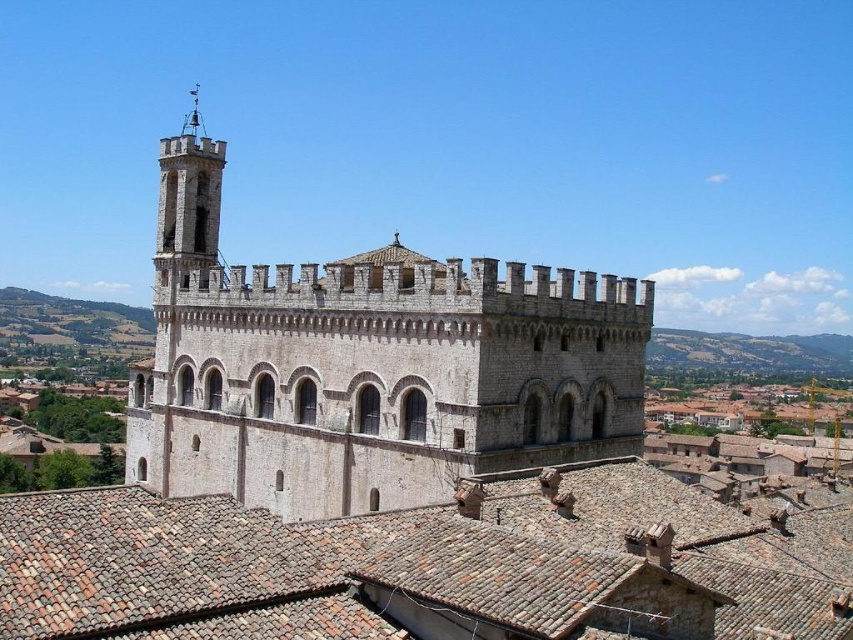
Question: Does white stone church at center have a greater width compared to brown tile roof at center?

Choices:
 (A) no
 (B) yes

Answer: (B)

Question: Where is white stone church at center located in relation to brown tile roof at center in the image?

Choices:
 (A) left
 (B) right

Answer: (A)

Question: Which object appears closest to the camera in this image?

Choices:
 (A) brown tile roof at center
 (B) white stone church at center

Answer: (A)

Question: Does white stone church at center have a larger size compared to brown tile roof at center?

Choices:
 (A) yes
 (B) no

Answer: (A)

Question: Which point is closer to the camera?

Choices:
 (A) white stone church at center
 (B) brown tile roof at center

Answer: (B)

Question: Which object appears farthest from the camera in this image?

Choices:
 (A) white stone church at center
 (B) brown tile roof at center

Answer: (A)